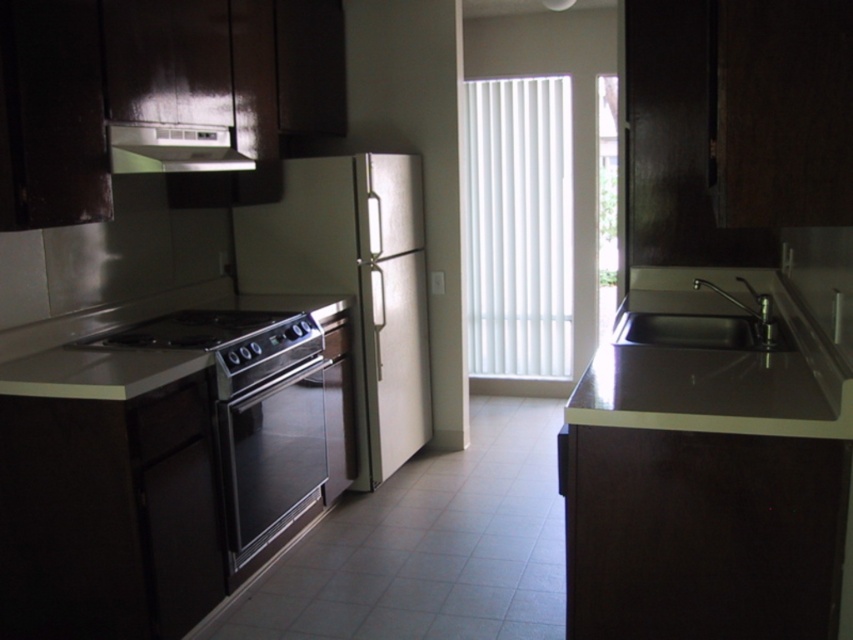
Is point (757, 20) closer to camera compared to point (763, 344)?

Yes, it is in front of point (763, 344).

Which is behind, point (785, 42) or point (618, 321)?

Positioned behind is point (618, 321).

Is point (729, 33) behind point (642, 333)?

No.

Locate an element on the screen. glossy wood cabinet at upper right is located at coordinates (780, 113).

Does brushed metal cabinet at left appear under satin black oven at center?

No, brushed metal cabinet at left is not below satin black oven at center.

Is point (55, 152) positioned in front of point (291, 390)?

Yes.

Is point (86, 113) farther from viewer compared to point (293, 404)?

No, (86, 113) is in front of (293, 404).

The image size is (853, 640). Identify the location of brushed metal cabinet at left. (51, 115).

Which is behind, point (659, 268) or point (173, 333)?

Positioned behind is point (659, 268).

Does black stainless steel sink at right have a smaller size compared to stainless steel oven at lower left?

No.

Is point (701, 337) positioned behind point (236, 356)?

That is True.

Where is `black stainless steel sink at right`? The height and width of the screenshot is (640, 853). black stainless steel sink at right is located at coordinates (701, 317).